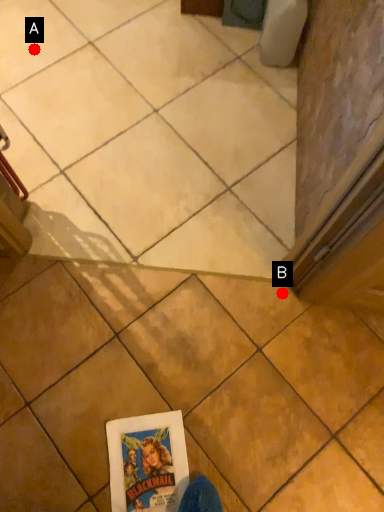
Question: Two points are circled on the image, labeled by A and B beside each circle. Among these points, which one is nearest to the camera?

Choices:
 (A) A is closer
 (B) B is closer

Answer: (B)